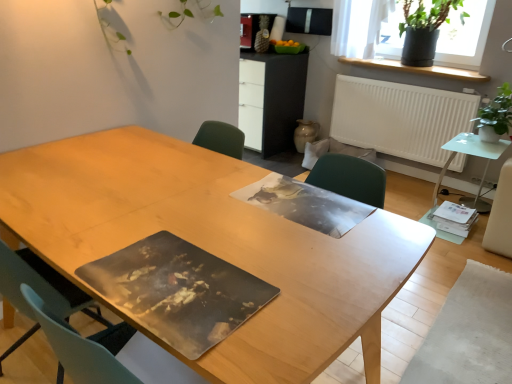
At what (x,y) coordinates should I click in order to perform the action: click on green leafy plant at right, which is the second houseplant in top-to-bottom order. Please return your answer as a coordinate pair (x, y). The height and width of the screenshot is (384, 512). Looking at the image, I should click on (496, 116).

The height and width of the screenshot is (384, 512). Describe the element at coordinates (423, 30) in the screenshot. I see `green matte plant pot at upper right, the 2th houseplant ordered from the bottom` at that location.

Where is `green leafy plant at right, the 1th houseplant when ordered from front to back`? The height and width of the screenshot is (384, 512). green leafy plant at right, the 1th houseplant when ordered from front to back is located at coordinates (496, 116).

Is wooden table at center, the 1th table positioned from the left, outside of green matte plant pot at upper right, marked as the first houseplant in a back-to-front arrangement?

Yes, wooden table at center, the 1th table positioned from the left, is not within green matte plant pot at upper right, marked as the first houseplant in a back-to-front arrangement.

The image size is (512, 384). I want to click on the 2nd houseplant behind the wooden table at center, the 2th table viewed from the right, so click(x=423, y=30).

Is wooden table at center, the 2th table viewed from the right, shorter than green matte plant pot at upper right, marked as the first houseplant in a back-to-front arrangement?

Incorrect, the height of wooden table at center, the 2th table viewed from the right, does not fall short of that of green matte plant pot at upper right, marked as the first houseplant in a back-to-front arrangement.

Could you tell me if wooden table at center, marked as the first table in a front-to-back arrangement, is turned towards green matte plant pot at upper right, acting as the 1th houseplant starting from the top?

Yes, wooden table at center, marked as the first table in a front-to-back arrangement, is facing green matte plant pot at upper right, acting as the 1th houseplant starting from the top.

Does green matte plant pot at upper right, acting as the 1th houseplant starting from the top, have a lesser height compared to green matte plant pot at upper right?

Yes, green matte plant pot at upper right, acting as the 1th houseplant starting from the top, is shorter than green matte plant pot at upper right.

From a real-world perspective, which object stands above the other?

In real-world perspective, green matte plant pot at upper right, the second houseplant positioned from the front, is above.

Which of these two, green matte plant pot at upper right, the 2th houseplant ordered from the bottom, or green matte plant pot at upper right, is smaller?

green matte plant pot at upper right, the 2th houseplant ordered from the bottom.

Does green matte plant pot at upper right, acting as the 1th houseplant starting from the top, lie behind green matte plant pot at upper right?

Yes, green matte plant pot at upper right, acting as the 1th houseplant starting from the top, is further from the camera.

Is wooden table at center, the 2th table viewed from the right, looking in the opposite direction of matte black cabinet at center?

wooden table at center, the 2th table viewed from the right, is not turned away from matte black cabinet at center.

Which of these two, wooden table at center, the 1th table positioned from the left, or matte black cabinet at center, is wider?

With larger width is wooden table at center, the 1th table positioned from the left.

Considering the positions of points (233, 178) and (273, 56), is point (233, 178) farther from camera compared to point (273, 56)?

No, (233, 178) is in front of (273, 56).

Locate an element on the screen. Image resolution: width=512 pixels, height=384 pixels. computer desk on the left side of green leafy plant at right, the 1th houseplant when ordered from front to back is located at coordinates (281, 98).

Would you consider matte black cabinet at center to be distant from green leafy plant at right, acting as the first houseplant starting from the bottom?

matte black cabinet at center is far away from green leafy plant at right, acting as the first houseplant starting from the bottom.

Between matte black cabinet at center and green leafy plant at right, the 1th houseplant when ordered from front to back, which one has smaller size?

With smaller size is green leafy plant at right, the 1th houseplant when ordered from front to back.

Which of these two, matte black cabinet at center or green leafy plant at right, the 1th houseplant when ordered from front to back, stands shorter?

green leafy plant at right, the 1th houseplant when ordered from front to back, is shorter.

In terms of height, does white matte radiator at upper right look taller or shorter compared to green matte plant pot at upper right?

white matte radiator at upper right is taller than green matte plant pot at upper right.

Can you confirm if white matte radiator at upper right is bigger than green matte plant pot at upper right?

Incorrect, white matte radiator at upper right is not larger than green matte plant pot at upper right.

Does white matte radiator at upper right lie behind green matte plant pot at upper right?

Yes, white matte radiator at upper right is further from the camera.

Is white matte radiator at upper right situated inside green matte plant pot at upper right or outside?

white matte radiator at upper right cannot be found inside green matte plant pot at upper right.

Can green matte plant pot at upper right, the 2th houseplant ordered from the bottom, be found inside green leafy plant at right, acting as the first houseplant starting from the bottom?

No, green matte plant pot at upper right, the 2th houseplant ordered from the bottom, is not a part of green leafy plant at right, acting as the first houseplant starting from the bottom.

Between green leafy plant at right, which is the second houseplant in top-to-bottom order, and green matte plant pot at upper right, acting as the 1th houseplant starting from the top, which one has larger size?

Bigger between the two is green matte plant pot at upper right, acting as the 1th houseplant starting from the top.

Can you confirm if green leafy plant at right, the 1th houseplant when ordered from front to back, is shorter than green matte plant pot at upper right, the 2th houseplant ordered from the bottom?

Yes.

This screenshot has width=512, height=384. I want to click on houseplant lying behind the green leafy plant at right, the 2th houseplant from the back, so pos(423,30).

From the image's perspective, does green leafy plant at right, the 1th houseplant when ordered from front to back, appear higher than white matte radiator at upper right?

No.

From a real-world perspective, who is located higher, green leafy plant at right, which is the second houseplant in top-to-bottom order, or white matte radiator at upper right?

In real-world perspective, green leafy plant at right, which is the second houseplant in top-to-bottom order, is above.

Is green leafy plant at right, acting as the first houseplant starting from the bottom, completely or partially outside of white matte radiator at upper right?

green leafy plant at right, acting as the first houseplant starting from the bottom, is positioned outside white matte radiator at upper right.

Is green leafy plant at right, the 1th houseplant when ordered from front to back, behind white matte radiator at upper right?

No, green leafy plant at right, the 1th houseplant when ordered from front to back, is closer to the camera.

There is a green matte plant pot at upper right, marked as the first houseplant in a back-to-front arrangement. At what (x,y) coordinates should I click in order to perform the action: click on the 2nd table below it (from the image's perspective). Please return your answer as a coordinate pair (x, y). Looking at the image, I should click on (213, 245).

The image size is (512, 384). What are the coordinates of `window that appears on the left of green matte plant pot at upper right, marked as the first houseplant in a back-to-front arrangement` in the screenshot? It's located at (465, 36).

Estimate the real-world distances between objects in this image. Which object is further from translucent glass side table at right, which ranks as the 1th table in right-to-left order, white matte radiator at upper right or green matte plant pot at upper right?

green matte plant pot at upper right lies further to translucent glass side table at right, which ranks as the 1th table in right-to-left order, than the other object.

Looking at the image, which one is located closer to wooden table at center, the 2th table viewed from the right, green leafy plant at right, the 1th houseplant when ordered from front to back, or green matte plant pot at upper right?

green leafy plant at right, the 1th houseplant when ordered from front to back, is closer to wooden table at center, the 2th table viewed from the right.

When comparing their distances from wooden table at center, the second table in the back-to-front sequence, does green matte plant pot at upper right, the 2th houseplant ordered from the bottom, or green leafy plant at right, the 2th houseplant from the back, seem closer?

Based on the image, green leafy plant at right, the 2th houseplant from the back, appears to be nearer to wooden table at center, the second table in the back-to-front sequence.

Estimate the real-world distances between objects in this image. Which object is closer to green leafy plant at right, the 2th houseplant from the back, translucent glass side table at right, which is counted as the 2th table, starting from the front, or green matte plant pot at upper right, marked as the first houseplant in a back-to-front arrangement?

translucent glass side table at right, which is counted as the 2th table, starting from the front, is positioned closer to the anchor green leafy plant at right, the 2th houseplant from the back.

Estimate the real-world distances between objects in this image. Which object is closer to green matte plant pot at upper right, the second houseplant positioned from the front, translucent glass side table at right, the 2th table viewed from the left, or wooden table at center, the 2th table viewed from the right?

The object closer to green matte plant pot at upper right, the second houseplant positioned from the front, is translucent glass side table at right, the 2th table viewed from the left.

Which object lies further to the anchor point wooden table at center, the second table in the back-to-front sequence, green matte plant pot at upper right or translucent glass side table at right, which ranks as the 1th table in right-to-left order?

Based on the image, green matte plant pot at upper right appears to be further to wooden table at center, the second table in the back-to-front sequence.

When comparing their distances from green leafy plant at right, the 2th houseplant from the back, does white matte radiator at upper right or green matte plant pot at upper right seem closer?

Based on the image, white matte radiator at upper right appears to be nearer to green leafy plant at right, the 2th houseplant from the back.

Based on their spatial positions, is white matte radiator at upper right or translucent glass side table at right, which ranks as the 1th table in right-to-left order, closer to green matte plant pot at upper right, acting as the 1th houseplant starting from the top?

white matte radiator at upper right is closer to green matte plant pot at upper right, acting as the 1th houseplant starting from the top.

Where is `houseplant positioned between wooden table at center, marked as the first table in a front-to-back arrangement, and green matte plant pot at upper right from near to far`? The image size is (512, 384). houseplant positioned between wooden table at center, marked as the first table in a front-to-back arrangement, and green matte plant pot at upper right from near to far is located at coordinates (496, 116).

Locate an element on the screen. table between wooden table at center, the 1th table positioned from the left, and green matte plant pot at upper right, along the z-axis is located at coordinates (473, 155).

This screenshot has width=512, height=384. In order to click on radiator between matte black cabinet at center and green leafy plant at right, acting as the first houseplant starting from the bottom, from left to right in this screenshot , I will do pyautogui.click(x=400, y=118).

Identify the location of radiator located between wooden table at center, marked as the first table in a front-to-back arrangement, and matte black cabinet at center in the depth direction. This screenshot has width=512, height=384. (400, 118).